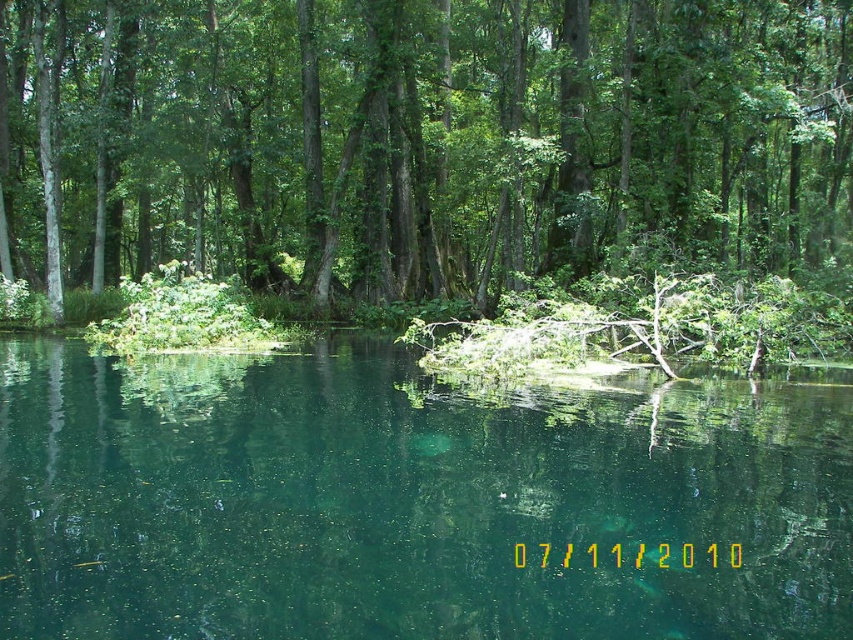
Does green leafy tree at center have a smaller size compared to green translucent water at center?

Incorrect, green leafy tree at center is not smaller in size than green translucent water at center.

Which is behind, point (804, 163) or point (740, 605)?

The point (804, 163) is behind.

This screenshot has width=853, height=640. I want to click on green leafy tree at center, so click(421, 141).